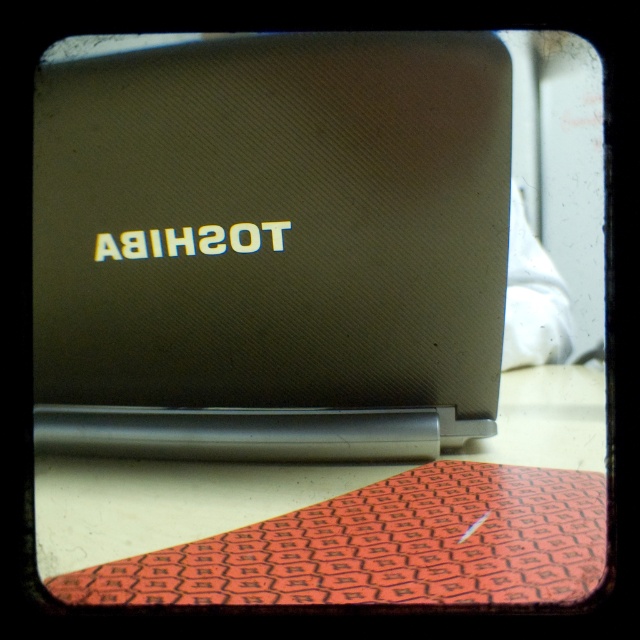
Question: Can you confirm if satin black laptop at center is positioned to the left of orange hexagonal patterned mat at lower center?

Choices:
 (A) no
 (B) yes

Answer: (B)

Question: Is satin black laptop at center positioned at the back of orange hexagonal patterned mat at lower center?

Choices:
 (A) no
 (B) yes

Answer: (B)

Question: Does satin black laptop at center appear on the right side of orange hexagonal patterned mat at lower center?

Choices:
 (A) no
 (B) yes

Answer: (A)

Question: Which of the following is the farthest from the observer?

Choices:
 (A) satin black laptop at center
 (B) orange hexagonal patterned mat at lower center

Answer: (A)

Question: Which point is closer to the camera?

Choices:
 (A) (529, 444)
 (B) (362, 221)

Answer: (B)

Question: Among these points, which one is farthest from the camera?

Choices:
 (A) (550, 387)
 (B) (477, 397)

Answer: (A)